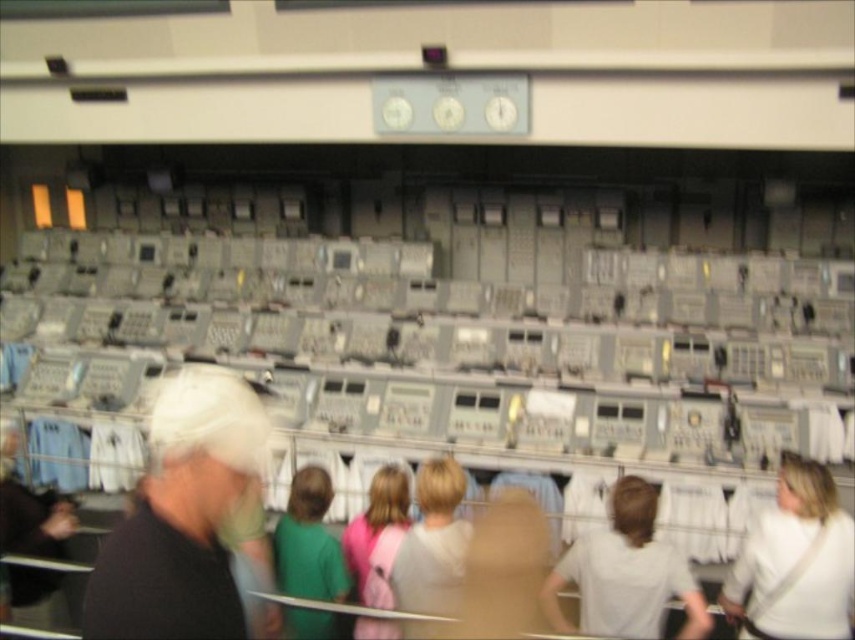
Which is in front, point (531, 572) or point (335, 570)?

Positioned in front is point (335, 570).

The image size is (855, 640). Find the location of `beige fabric shirt at center`. beige fabric shirt at center is located at coordinates (504, 566).

At what (x,y) coordinates should I click in order to perform the action: click on beige fabric shirt at center. Please return your answer as a coordinate pair (x, y). This screenshot has width=855, height=640. Looking at the image, I should click on (504, 566).

Is white fabric bag at lower right below light gray sweater at center?

Yes, white fabric bag at lower right is below light gray sweater at center.

Describe the element at coordinates (795, 561) in the screenshot. The width and height of the screenshot is (855, 640). I see `white fabric bag at lower right` at that location.

Is point (799, 490) positioned after point (407, 588)?

Yes, it is.

Identify the location of white fabric bag at lower right. (795, 561).

Between point (187, 467) and point (286, 588), which one is positioned in front?

Positioned in front is point (187, 467).

Does white matte cap at upper left appear on the left side of green matte shirt at center?

Correct, you'll find white matte cap at upper left to the left of green matte shirt at center.

Is point (115, 637) in front of point (342, 564)?

That is True.

This screenshot has height=640, width=855. I want to click on white matte cap at upper left, so click(x=186, y=515).